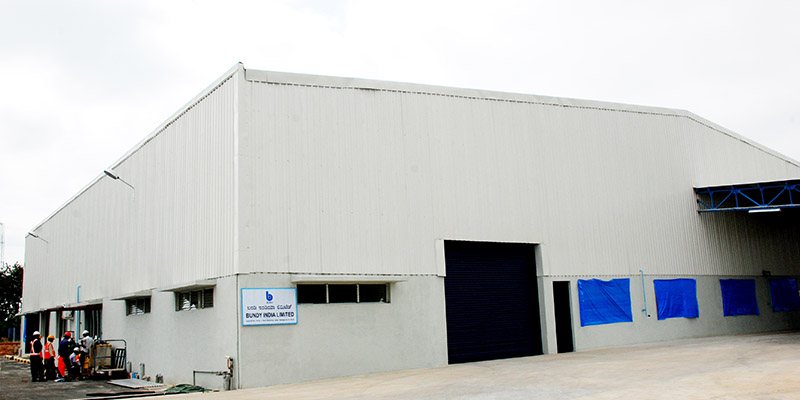
Locate an element on the screen. blue coverings is located at coordinates (784, 291), (734, 287), (670, 290), (610, 291).